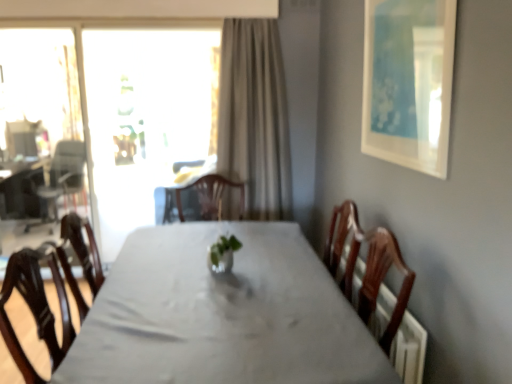
I want to click on white matte picture frame at upper right, so 408,82.

This screenshot has width=512, height=384. Describe the element at coordinates (115, 107) in the screenshot. I see `transparent glass window at upper left` at that location.

Find the location of a particular element. The width and height of the screenshot is (512, 384). beige fabric curtain at center is located at coordinates (255, 117).

Considering the sizes of objects matte black armchair at left and white glossy table at center in the image provided, who is wider, matte black armchair at left or white glossy table at center?

Wider between the two is white glossy table at center.

Which of these two, matte black armchair at left or white glossy table at center, stands taller?

With more height is matte black armchair at left.

Considering the positions of objects matte black armchair at left and white glossy table at center in the image provided, who is behind, matte black armchair at left or white glossy table at center?

matte black armchair at left.

How distant is matte black armchair at left from white glossy table at center?

The distance of matte black armchair at left from white glossy table at center is 3.77 meters.

Considering the relative sizes of white glossy table at center and matte black armchair at left in the image provided, is white glossy table at center taller than matte black armchair at left?

Incorrect, the height of white glossy table at center is not larger of that of matte black armchair at left.

Locate an element on the screen. armchair that appears above the white glossy table at center (from the image's perspective) is located at coordinates (64, 173).

From the picture: Measure the distance between white glossy table at center and matte black armchair at left.

white glossy table at center is 3.77 meters away from matte black armchair at left.

Can you confirm if white glossy table at center is bigger than matte black armchair at left?

Yes.

Does transparent glass screen door at left lie behind white glossy table at center?

Yes, it is behind white glossy table at center.

Does transparent glass screen door at left touch white glossy table at center?

transparent glass screen door at left and white glossy table at center are clearly separated.

In terms of width, does transparent glass screen door at left look wider or thinner when compared to white glossy table at center?

Considering their sizes, transparent glass screen door at left looks slimmer than white glossy table at center.

From a real-world perspective, which object stands above the other?

white matte picture frame at upper right, from a real-world perspective.

Can you see white glossy table at center touching white matte picture frame at upper right?

They are not placed beside each other.

Is white glossy table at center not inside white matte picture frame at upper right?

Yes.

Is white glossy table at center bigger or smaller than white matte picture frame at upper right?

Clearly, white glossy table at center is larger in size than white matte picture frame at upper right.

Which object is more forward, beige fabric curtain at center or matte black armchair at left?

beige fabric curtain at center is in front.

Which is further, [247,128] or [68,157]?

The point [68,157] is more distant.

Does beige fabric curtain at center have a smaller size compared to matte black armchair at left?

Yes.

Can you confirm if beige fabric curtain at center is shorter than matte black armchair at left?

No.

From a real-world perspective, which is physically above, beige fabric curtain at center or white glossy table at center?

beige fabric curtain at center is physically above.

In the scene shown: From the image's perspective, is beige fabric curtain at center above white glossy table at center?

Yes, from the image's perspective, beige fabric curtain at center is over white glossy table at center.

Is beige fabric curtain at center not close to white glossy table at center?

beige fabric curtain at center is far away from white glossy table at center.

How many degrees apart are the facing directions of beige fabric curtain at center and white glossy table at center?

90.3 degrees.

In terms of size, does white glossy table at center appear bigger or smaller than transparent glass window at upper left?

Clearly, white glossy table at center is larger in size than transparent glass window at upper left.

From the image's perspective, which one is positioned lower, white glossy table at center or transparent glass window at upper left?

white glossy table at center.

How much distance is there between white glossy table at center and transparent glass window at upper left?

2.55 meters.

This screenshot has height=384, width=512. What are the coordinates of `table in front of the matte black armchair at left` in the screenshot? It's located at (222, 314).

The height and width of the screenshot is (384, 512). Identify the location of armchair behind the white glossy table at center. (64, 173).

Estimate the real-world distances between objects in this image. Which object is closer to white glossy table at center, transparent glass window at upper left or matte black armchair at left?

transparent glass window at upper left is closer to white glossy table at center.

Based on the photo, from the image, which object appears to be nearer to transparent glass window at upper left, white glossy table at center or matte black armchair at left?

The object closer to transparent glass window at upper left is matte black armchair at left.

Looking at the image, which one is located closer to white glossy table at center, beige fabric curtain at center or transparent glass screen door at left?

Based on the image, beige fabric curtain at center appears to be nearer to white glossy table at center.

Looking at the image, which one is located closer to beige fabric curtain at center, transparent glass window at upper left or matte black armchair at left?

transparent glass window at upper left.

Based on their spatial positions, is transparent glass window at upper left or white glossy table at center further from transparent glass screen door at left?

white glossy table at center lies further to transparent glass screen door at left than the other object.

From the image, which object appears to be farther from beige fabric curtain at center, transparent glass screen door at left or white glossy table at center?

transparent glass screen door at left is positioned further to the anchor beige fabric curtain at center.

Considering their positions, is white matte picture frame at upper right positioned closer to beige fabric curtain at center than transparent glass screen door at left?

Based on the image, white matte picture frame at upper right appears to be nearer to beige fabric curtain at center.

Considering their positions, is matte black armchair at left positioned closer to beige fabric curtain at center than white glossy table at center?

white glossy table at center.

Locate an element on the screen. The width and height of the screenshot is (512, 384). curtain located between white glossy table at center and matte black armchair at left in the depth direction is located at coordinates (255, 117).

Where is `window between matte black armchair at left and beige fabric curtain at center from left to right`? window between matte black armchair at left and beige fabric curtain at center from left to right is located at coordinates (115, 107).

Where is `screen door located between white glossy table at center and matte black armchair at left in the depth direction`? The height and width of the screenshot is (384, 512). screen door located between white glossy table at center and matte black armchair at left in the depth direction is located at coordinates (50, 117).

Find the location of a particular element. This screenshot has height=384, width=512. window positioned between white matte picture frame at upper right and matte black armchair at left from near to far is located at coordinates (115, 107).